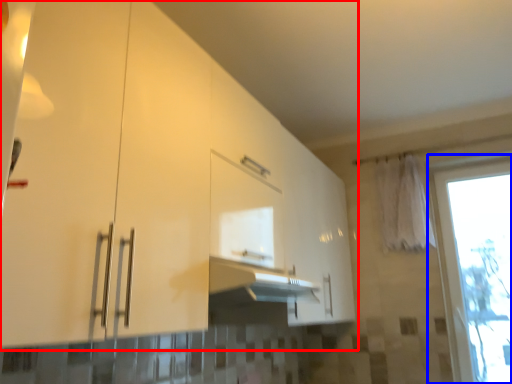
Question: Among these objects, which one is nearest to the camera, cabinetry (highlighted by a red box) or window (highlighted by a blue box)?

Choices:
 (A) cabinetry
 (B) window

Answer: (A)